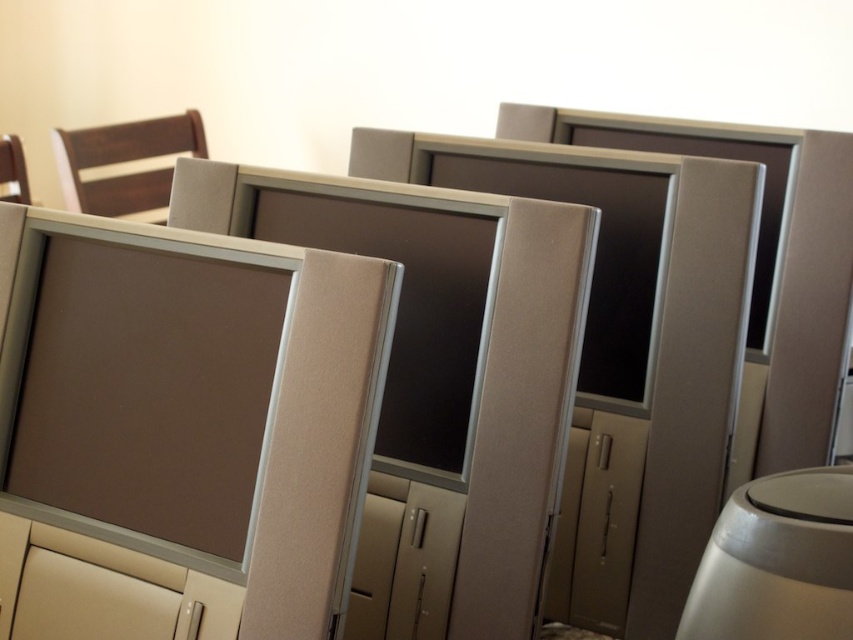
Question: Among these points, which one is farthest from the camera?

Choices:
 (A) (566, 157)
 (B) (109, 477)
 (C) (827, 472)

Answer: (A)

Question: Considering the relative positions of matte gray monitor at left and matte brown chair at left in the image provided, where is matte gray monitor at left located with respect to matte brown chair at left?

Choices:
 (A) below
 (B) above

Answer: (A)

Question: Which point appears closest to the camera in this image?

Choices:
 (A) (503, 147)
 (B) (703, 573)
 (C) (12, 188)
 (D) (410, 225)

Answer: (B)

Question: Is satin silver monitor at center bigger than dark wood chair at upper left?

Choices:
 (A) no
 (B) yes

Answer: (B)

Question: Among these points, which one is farthest from the camera?

Choices:
 (A) coord(154,136)
 (B) coord(228,464)
 (C) coord(19,147)
 (D) coord(264,189)

Answer: (A)

Question: Is white glossy table at lower right to the left of dark wood chair at upper left from the viewer's perspective?

Choices:
 (A) no
 (B) yes

Answer: (A)